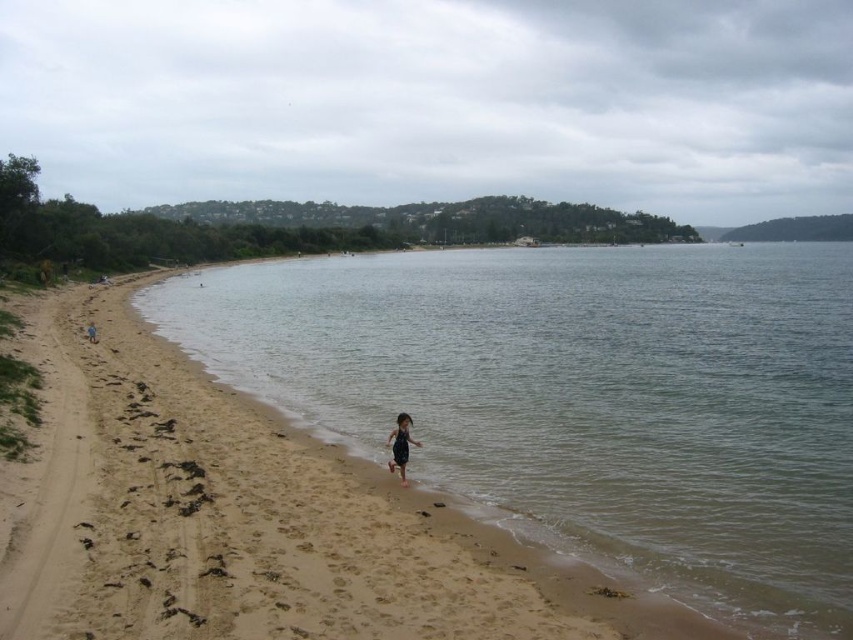
Can you confirm if dark blue swimsuit at center is smaller than dark blue swimsuit at lower left?

Yes.

Is dark blue swimsuit at center closer to the viewer compared to dark blue swimsuit at lower left?

Yes, dark blue swimsuit at center is in front of dark blue swimsuit at lower left.

Describe the element at coordinates (399, 444) in the screenshot. I see `dark blue swimsuit at center` at that location.

This screenshot has width=853, height=640. What are the coordinates of `dark blue swimsuit at center` in the screenshot? It's located at (399, 444).

Is clear water at center taller than dark blue swimsuit at center?

Correct, clear water at center is much taller as dark blue swimsuit at center.

Is point (851, 422) positioned before point (396, 433)?

No, (851, 422) is further to viewer.

Between point (338, 422) and point (389, 470), which one is positioned behind?

Positioned behind is point (338, 422).

Locate an element on the screen. The width and height of the screenshot is (853, 640). clear water at center is located at coordinates (582, 400).

This screenshot has width=853, height=640. What do you see at coordinates (582, 400) in the screenshot?
I see `clear water at center` at bounding box center [582, 400].

Which is more to the left, clear water at center or dark blue swimsuit at lower left?

Positioned to the left is dark blue swimsuit at lower left.

Who is more forward, (x=599, y=467) or (x=93, y=339)?

Point (x=599, y=467) is more forward.

You are a GUI agent. You are given a task and a screenshot of the screen. Output one action in this format:
    pyautogui.click(x=<x>, y=<y>)
    Task: Click on the clear water at center
    Image resolution: width=853 pixels, height=640 pixels.
    Given the screenshot: What is the action you would take?
    pyautogui.click(x=582, y=400)